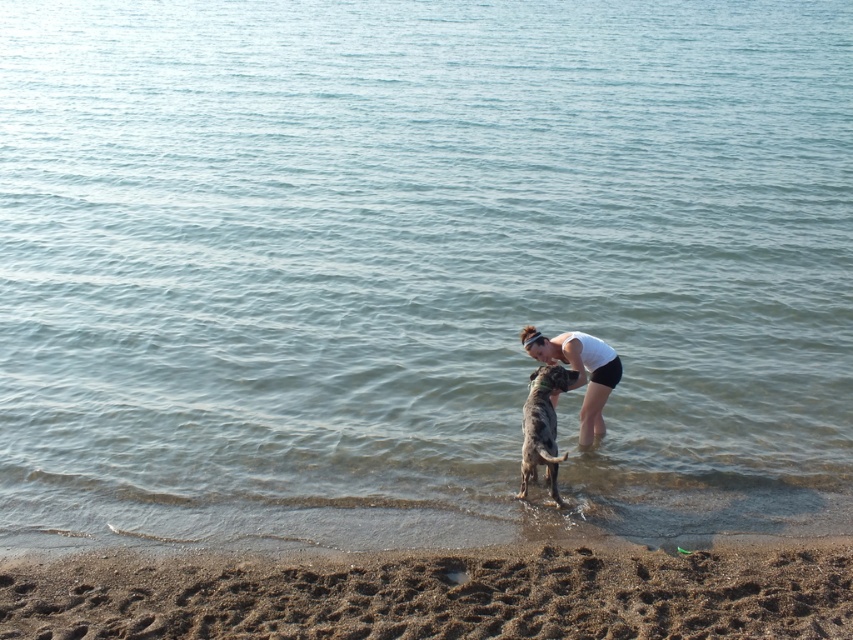
Between white matte shirt at center and speckled fur dog at center, which one is positioned higher?

Positioned higher is white matte shirt at center.

This screenshot has width=853, height=640. What do you see at coordinates (579, 371) in the screenshot?
I see `white matte shirt at center` at bounding box center [579, 371].

I want to click on white matte shirt at center, so click(579, 371).

Is brown sandy mud at lower center closer to camera compared to speckled fur dog at center?

Yes, it is in front of speckled fur dog at center.

Which is above, brown sandy mud at lower center or speckled fur dog at center?

speckled fur dog at center is above.

Which is behind, point (61, 592) or point (552, 442)?

Point (552, 442)

Find the location of a particular element. The image size is (853, 640). brown sandy mud at lower center is located at coordinates (437, 593).

Is point (206, 632) in front of point (569, 352)?

Yes, point (206, 632) is closer to viewer.

Does brown sandy mud at lower center appear over white matte shirt at center?

Actually, brown sandy mud at lower center is below white matte shirt at center.

Find the location of a particular element. This screenshot has width=853, height=640. brown sandy mud at lower center is located at coordinates (437, 593).

This screenshot has width=853, height=640. I want to click on brown sandy mud at lower center, so click(x=437, y=593).